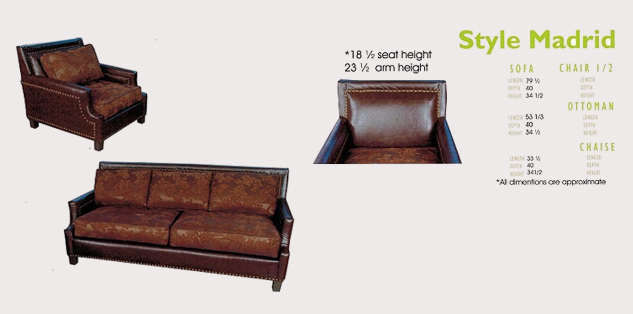
The image size is (633, 314). What are the coordinates of `back couch cushion` in the screenshot? It's located at (126, 185), (176, 185), (249, 192).